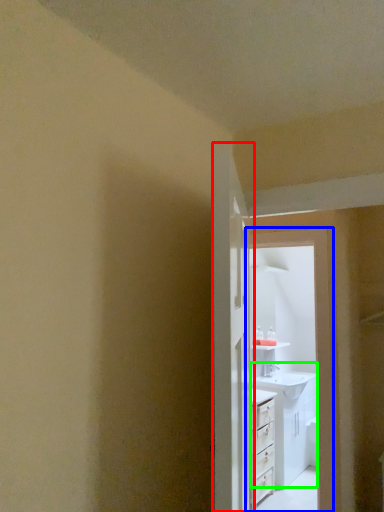
Question: Which object is positioned farthest from door (highlighted by a red box)? Select from screen door (highlighted by a blue box) and sink (highlighted by a green box).

Choices:
 (A) screen door
 (B) sink

Answer: (B)